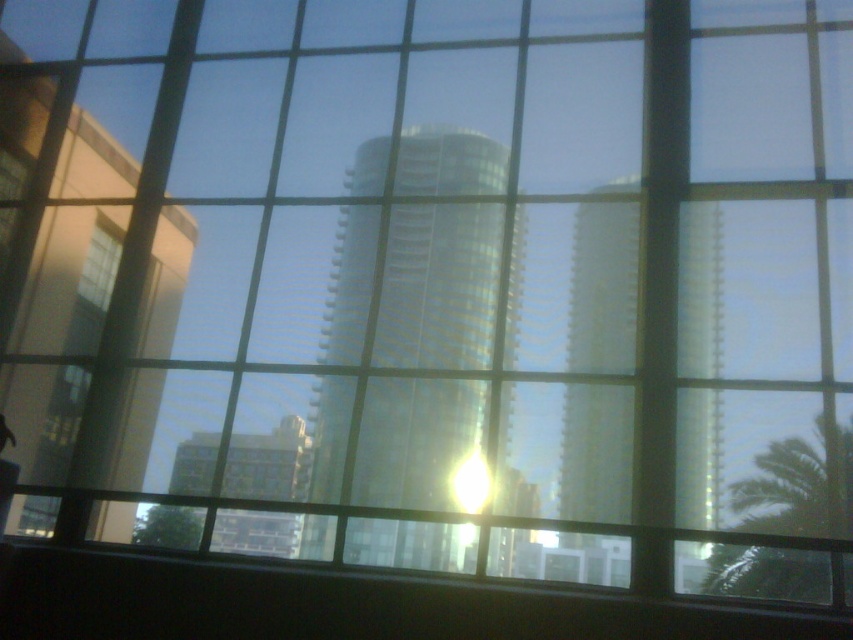
Question: Is shiny glass tower at center smaller than reflective glass tower at center?

Choices:
 (A) no
 (B) yes

Answer: (A)

Question: Which object is the closest to the green leafy palm tree at lower right?

Choices:
 (A) reflective glass tower at center
 (B) shiny glass tower at center

Answer: (A)

Question: Does reflective glass tower at center have a smaller size compared to green leafy palm tree at lower right?

Choices:
 (A) no
 (B) yes

Answer: (A)

Question: Estimate the real-world distances between objects in this image. Which object is farther from the green leafy palm tree at lower right?

Choices:
 (A) shiny glass tower at center
 (B) reflective glass tower at center

Answer: (A)

Question: Estimate the real-world distances between objects in this image. Which object is closer to the shiny glass tower at center?

Choices:
 (A) green leafy palm tree at lower right
 (B) reflective glass tower at center

Answer: (B)

Question: Does reflective glass tower at center have a greater width compared to green leafy palm tree at lower right?

Choices:
 (A) no
 (B) yes

Answer: (B)